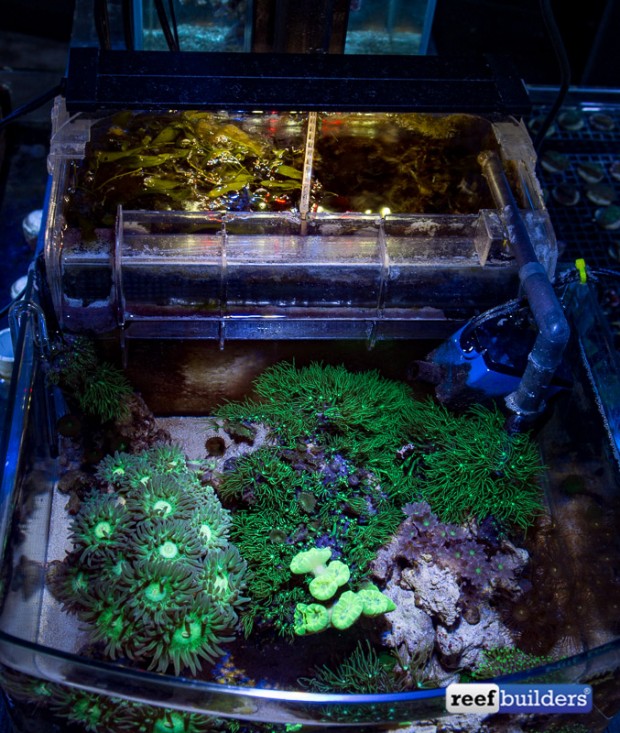
This screenshot has width=620, height=733. Find the location of `aquarium tank`. aquarium tank is located at coordinates (294, 287).